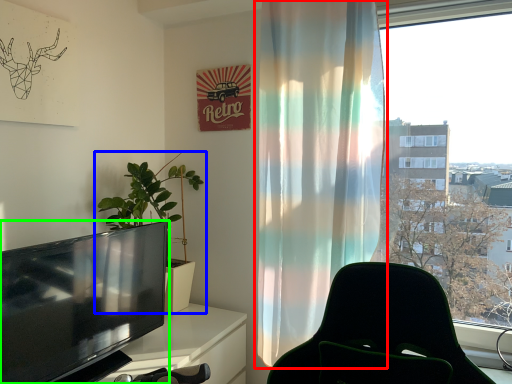
Question: Which object is the farthest from curtain (highlighted by a red box)? Choose among these: houseplant (highlighted by a blue box) or television (highlighted by a green box).

Choices:
 (A) houseplant
 (B) television

Answer: (A)